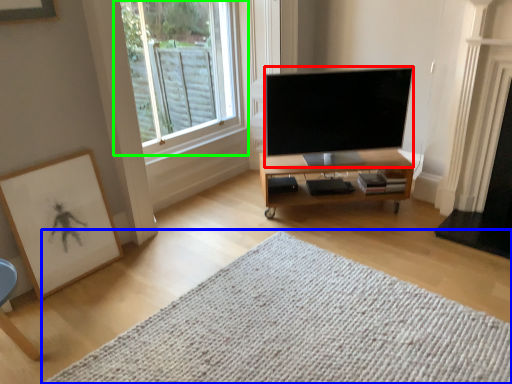
Question: Considering the real-world distances, which object is farthest from television (highlighted by a red box)? mat (highlighted by a blue box) or window (highlighted by a green box)?

Choices:
 (A) mat
 (B) window

Answer: (A)